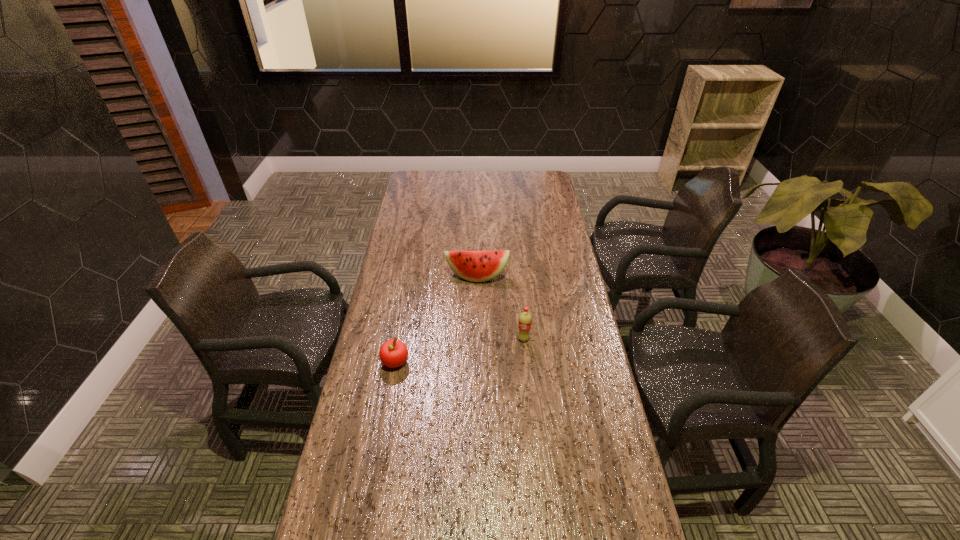
Image resolution: width=960 pixels, height=540 pixels. I want to click on the second nearest object, so click(525, 320).

Locate an element on the screen. soda is located at coordinates (525, 320).

The width and height of the screenshot is (960, 540). I want to click on the farthest object, so click(x=476, y=266).

Locate an element on the screen. The width and height of the screenshot is (960, 540). watermelon is located at coordinates (476, 266).

This screenshot has width=960, height=540. I want to click on apple, so click(393, 353).

What are the coordinates of `the leftmost object` in the screenshot? It's located at (393, 353).

The width and height of the screenshot is (960, 540). What are the coordinates of `free region located on the back of the rightmost object` in the screenshot? It's located at (518, 290).

Identify the location of free space located on the outer rind of the second object from right to left. (476, 353).

Identify the location of blank space located 0.130m on the back of the nearest object. (402, 322).

Identify the location of object at the left edge. (393, 353).